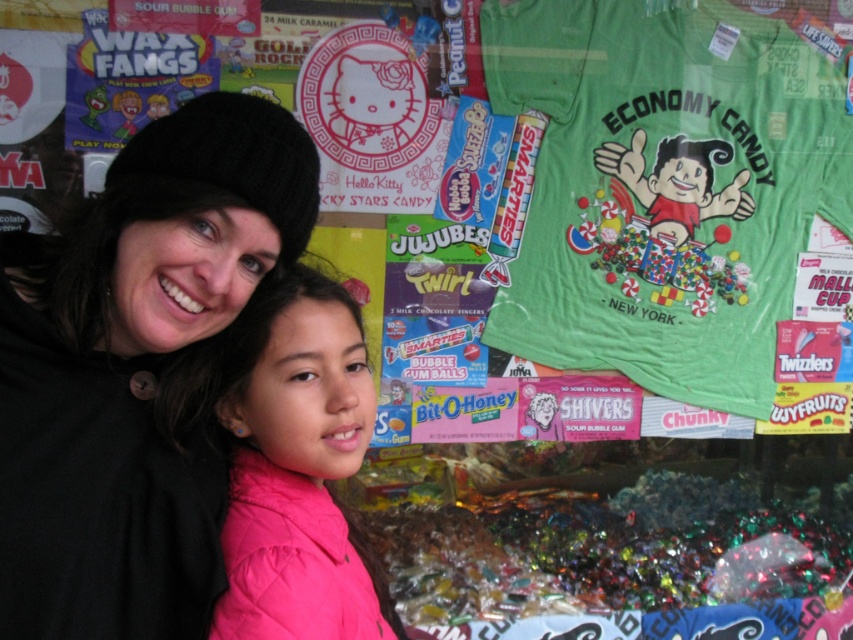
You are a graphic designer working on a layout for a candy store advertisement. You need to place a new logo in the top right corner of the image. The black knit hat at upper left is currently occupying part of that area. Can you determine if there is enough space to place the logo without overlapping the hat?

The black knit hat at upper left is located at point (132,369), so placing a logo in the top right corner should not overlap with it as the coordinates are far apart.

You are a photographer setting up for a photo shoot. You have a camera with a 30cm wide lens. The scene requires capturing both the black knit hat at upper left and the pink quilted jacket at center without cropping either. Can the lens width accommodate both objects in the frame?

The black knit hat at upper left might be wider than the pink quilted jacket at center, so the total width required to include both could exceed the 30cm lens width. It is uncertain if the lens can accommodate both without cropping.